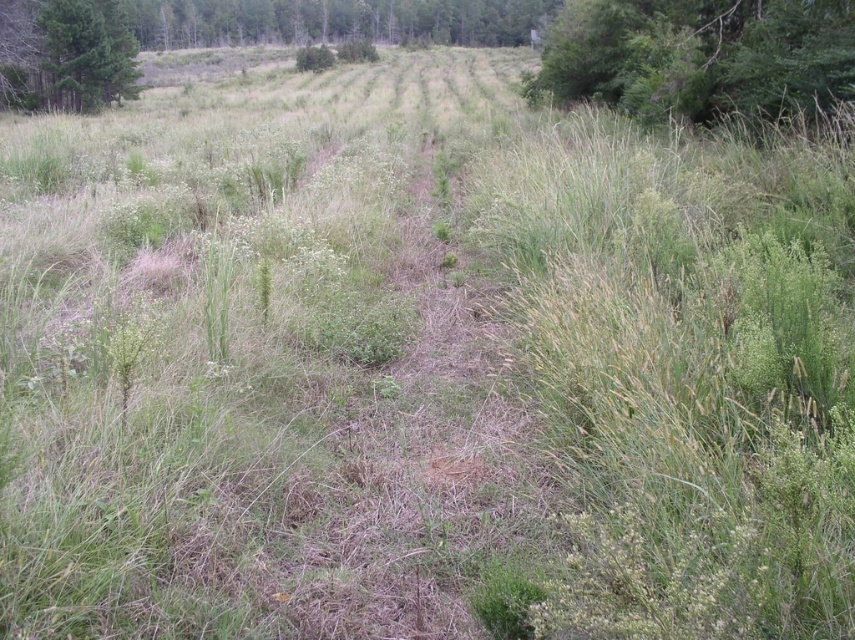
Question: Which object appears closest to the camera in this image?

Choices:
 (A) green leafy tree at upper right
 (B) green matte tree at upper left

Answer: (A)

Question: Can you confirm if green leafy tree at upper right is positioned to the right of green matte tree at upper left?

Choices:
 (A) yes
 (B) no

Answer: (A)

Question: Which of the following is the farthest from the observer?

Choices:
 (A) (99, 16)
 (B) (724, 99)

Answer: (A)

Question: Is green leafy tree at upper right positioned at the back of green matte tree at upper left?

Choices:
 (A) no
 (B) yes

Answer: (A)

Question: Is green leafy tree at upper right behind green matte tree at upper left?

Choices:
 (A) yes
 (B) no

Answer: (B)